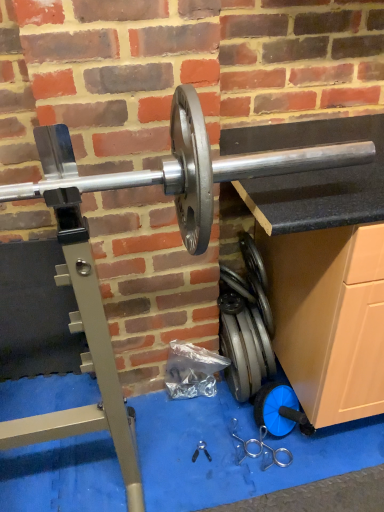
Question: From the image's perspective, is black plastic pliers at center, which is the 2th tool from right to left, under silver metallic barbell at center?

Choices:
 (A) no
 (B) yes

Answer: (B)

Question: Is black plastic pliers at center, placed as the first tool when sorted from left to right, smaller than silver metallic barbell at center?

Choices:
 (A) yes
 (B) no

Answer: (A)

Question: Could you tell me if black plastic pliers at center, which is the 2th tool from right to left, is turned towards silver metallic barbell at center?

Choices:
 (A) yes
 (B) no

Answer: (B)

Question: Considering the relative positions of black plastic pliers at center, which is the 2th tool from right to left, and silver metallic barbell at center in the image provided, is black plastic pliers at center, which is the 2th tool from right to left, to the left of silver metallic barbell at center from the viewer's perspective?

Choices:
 (A) no
 (B) yes

Answer: (A)

Question: Is black plastic pliers at center, which is the 2th tool from right to left, completely or partially outside of silver metallic barbell at center?

Choices:
 (A) no
 (B) yes

Answer: (B)

Question: Considering their positions, is silver metallic barbell at center located in front of or behind silver metallic weight at lower center, the second tool from the left?

Choices:
 (A) front
 (B) behind

Answer: (A)

Question: Considering the positions of silver metallic barbell at center and silver metallic weight at lower center, the second tool from the left, in the image, is silver metallic barbell at center wider or thinner than silver metallic weight at lower center, the second tool from the left,?

Choices:
 (A) wide
 (B) thin

Answer: (A)

Question: From a real-world perspective, is silver metallic barbell at center physically located above or below silver metallic weight at lower center, the second tool from the left?

Choices:
 (A) below
 (B) above

Answer: (B)

Question: From the image's perspective, is silver metallic barbell at center above or below silver metallic weight at lower center, the second tool from the left?

Choices:
 (A) above
 (B) below

Answer: (A)

Question: In the image, is black plastic pliers at center, which is the 2th tool from right to left, on the left side or the right side of silver metallic barbell at center?

Choices:
 (A) left
 (B) right

Answer: (B)

Question: From a real-world perspective, relative to silver metallic barbell at center, is black plastic pliers at center, placed as the first tool when sorted from left to right, vertically above or below?

Choices:
 (A) above
 (B) below

Answer: (B)

Question: Which is correct: black plastic pliers at center, which is the 2th tool from right to left, is inside silver metallic barbell at center, or outside of it?

Choices:
 (A) inside
 (B) outside

Answer: (B)

Question: From the image's perspective, relative to silver metallic barbell at center, is black plastic pliers at center, placed as the first tool when sorted from left to right, above or below?

Choices:
 (A) below
 (B) above

Answer: (A)

Question: Is point (266, 455) positioned closer to the camera than point (198, 198)?

Choices:
 (A) closer
 (B) farther

Answer: (B)

Question: From the image's perspective, is silver metallic weight at lower center, the second tool from the left, above or below silver metallic barbell at center?

Choices:
 (A) above
 (B) below

Answer: (B)